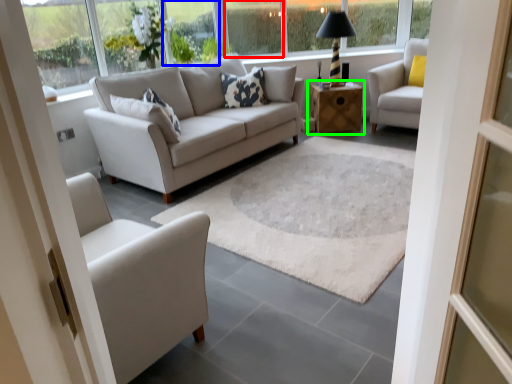
Question: Based on their relative distances, which object is nearer to window (highlighted by a red box)? Choose from window (highlighted by a blue box) and table (highlighted by a green box).

Choices:
 (A) window
 (B) table

Answer: (A)